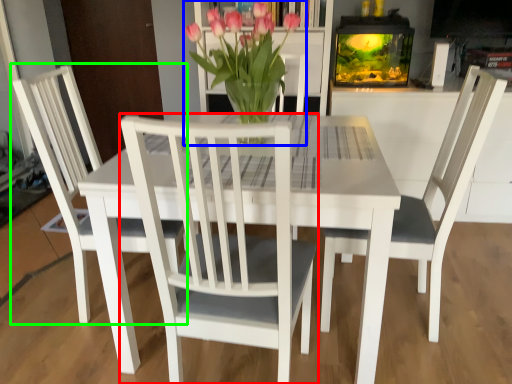
Question: Based on their relative distances, which object is nearer to chair (highlighted by a red box)? Choose from houseplant (highlighted by a blue box) and chair (highlighted by a green box).

Choices:
 (A) houseplant
 (B) chair

Answer: (A)